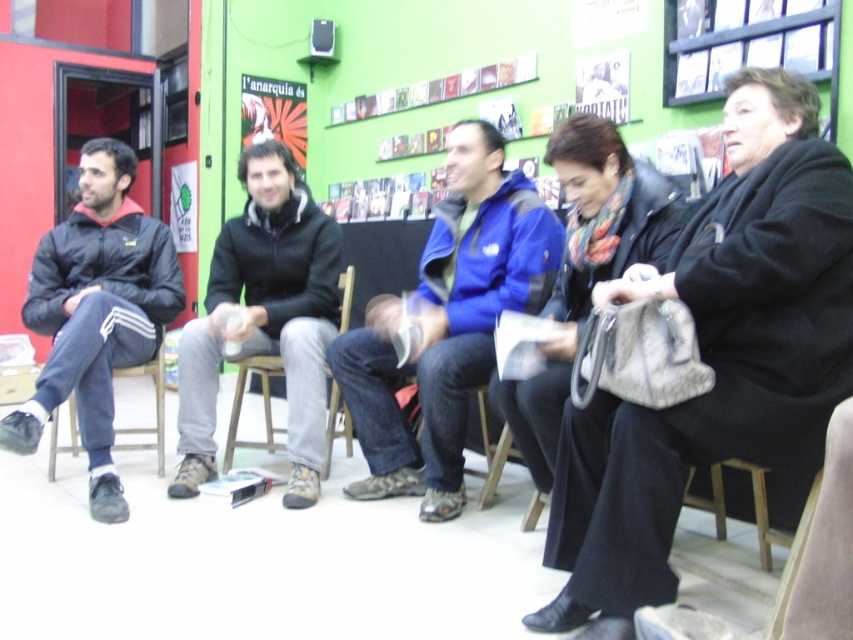
Does point (811, 220) come farther from viewer compared to point (225, 461)?

No.

Can you confirm if dark gray wool coat at center is positioned to the left of wooden chair at center?

Incorrect, dark gray wool coat at center is not on the left side of wooden chair at center.

Between point (563, 563) and point (234, 388), which one is positioned behind?

The point (234, 388) is more distant.

The width and height of the screenshot is (853, 640). Identify the location of dark gray wool coat at center. (714, 356).

Is dark gray wool coat at center positioned behind blue fleece jacket at center?

No, it is in front of blue fleece jacket at center.

Is point (744, 216) positioned after point (480, 202)?

No.

Find the location of a particular element. dark gray wool coat at center is located at coordinates (714, 356).

Can you confirm if wooden chair at center is wider than wooden stool at left?

Incorrect, wooden chair at center's width does not surpass wooden stool at left's.

Can you confirm if wooden chair at center is bigger than wooden stool at left?

Yes, wooden chair at center is bigger than wooden stool at left.

Does point (259, 374) lie behind point (154, 394)?

That is True.

This screenshot has height=640, width=853. I want to click on wooden chair at center, so tap(262, 401).